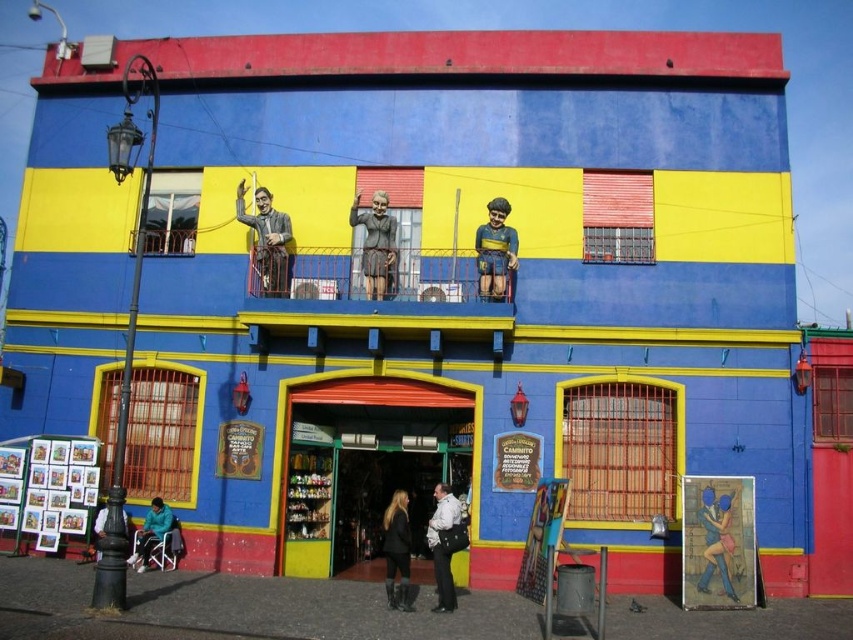
Question: Is smooth gray statue at center wider than black leather boots at lower center?

Choices:
 (A) yes
 (B) no

Answer: (A)

Question: Does matte plastic store at center lie behind matte gray statue at upper center?

Choices:
 (A) no
 (B) yes

Answer: (A)

Question: Which point is farther to the camera?

Choices:
 (A) matte gray statue at upper center
 (B) smooth gray statue at center
 (C) matte black jacket at lower left
 (D) teal fabric jacket at lower left

Answer: (A)

Question: Which of these objects is positioned closest to the yellow fabric turban at upper center?

Choices:
 (A) matte plastic store at center
 (B) matte black jacket at lower left
 (C) smooth gray statue at center
 (D) white cotton shirt at center

Answer: (C)

Question: Which point is closer to the camera taking this photo?

Choices:
 (A) (274, 296)
 (B) (357, 381)

Answer: (A)

Question: Is yellow fabric turban at upper center in front of blue glossy statue at lower right?

Choices:
 (A) no
 (B) yes

Answer: (A)